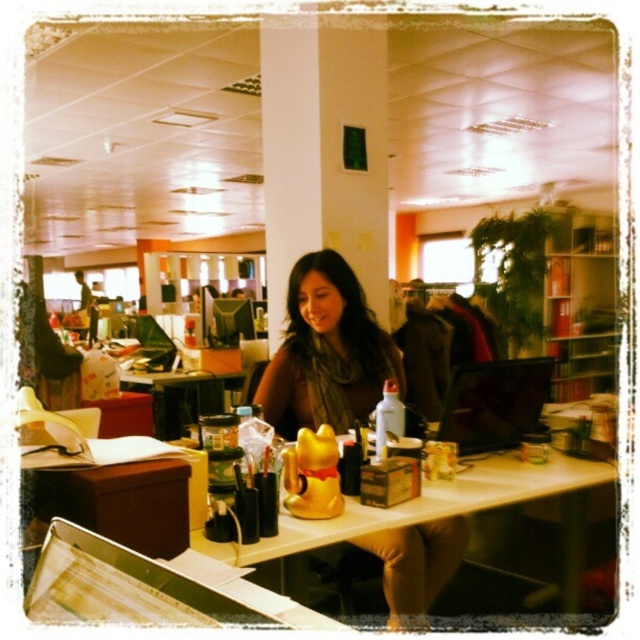
You are an office worker who needs to place a new monitor on the desk. The monitor requires a space of 30 cm in height. Can you determine if there is enough vertical space between the brown hair at center and the white glossy table at center to place the monitor?

The brown hair at center is located above the white glossy table at center, but the vertical distance between them is not specified. Therefore, it is uncertain if there is enough space to place the monitor.

You are organizing items on the desk and need to place a new object between the matte gold statue at center and the white glossy table at center. Considering their widths, which object should you place closer to the narrower one?

The matte gold statue at center has a lesser width compared to the white glossy table at center, so you should place the new object closer to the matte gold statue at center since it is narrower.

You are an office worker who wants to place a new plant on the desk. The plant needs to be taller than the existing items to be visible over them. Given the current items on the desk, which include the matte gold statue at center and the brown hair at center, can you determine if the plant will be visible over these items?

The matte gold statue at center has a lesser height compared to brown hair at center. Therefore, if the plant is taller than both items, it will be visible over them. However, since the brown hair at center is taller than the statue, the plant must exceed the height of the brown hair at center to be visible over all existing items.